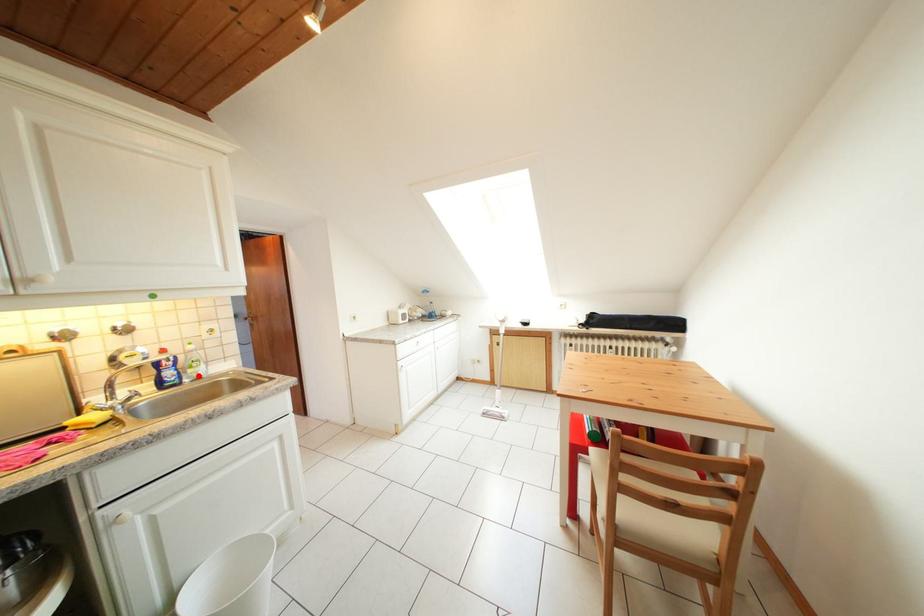
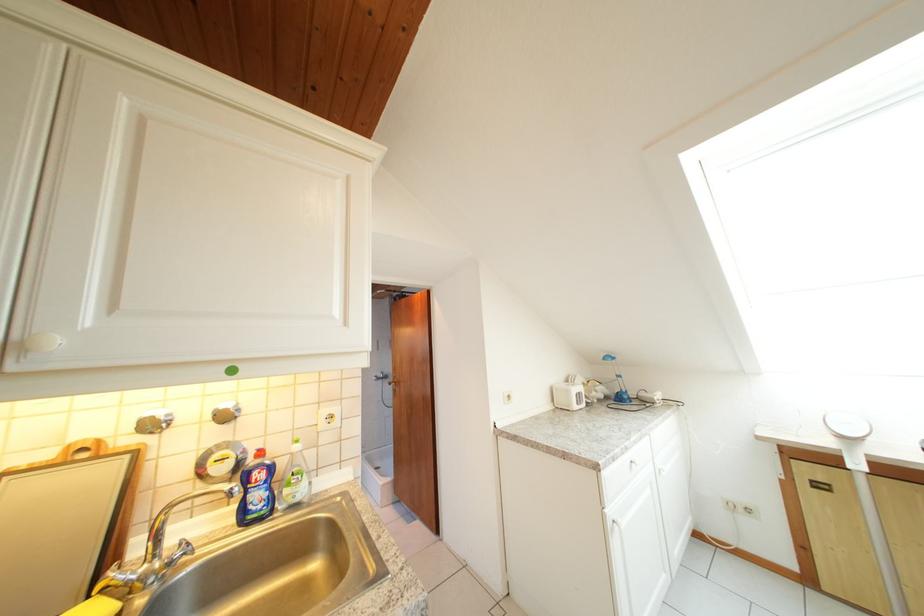
Question: I am providing you with two images of the same scene from different viewpoints. A red point is marked on the first image. Can you still see the location of the red point in image 2?

Choices:
 (A) Yes
 (B) No

Answer: (A)